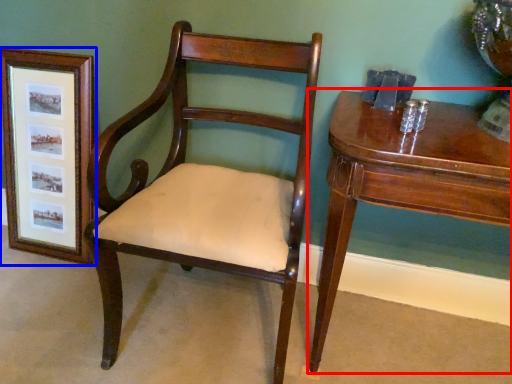
Question: Which object is further to the camera taking this photo, table (highlighted by a red box) or picture frame (highlighted by a blue box)?

Choices:
 (A) table
 (B) picture frame

Answer: (B)